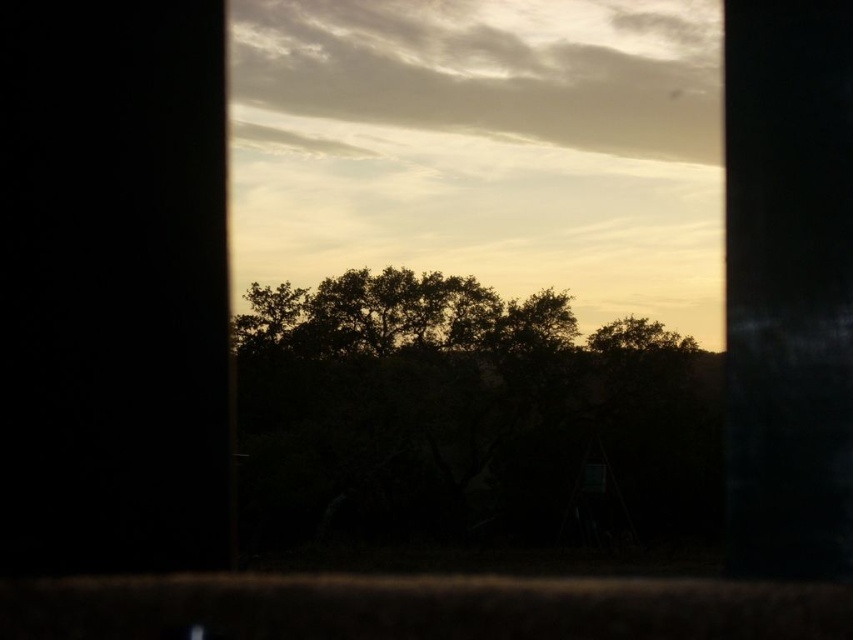
Question: Does transparent glass window at upper center come in front of silhouette leafy tree at center?

Choices:
 (A) yes
 (B) no

Answer: (A)

Question: Is transparent glass window at upper center below silhouette leafy tree at center?

Choices:
 (A) yes
 (B) no

Answer: (B)

Question: Does transparent glass window at upper center have a lesser width compared to silhouette leafy tree at center?

Choices:
 (A) no
 (B) yes

Answer: (A)

Question: Which point is closer to the camera?

Choices:
 (A) (523, 500)
 (B) (506, 488)

Answer: (A)

Question: Among these points, which one is nearest to the camera?

Choices:
 (A) (282, 278)
 (B) (556, 364)

Answer: (B)